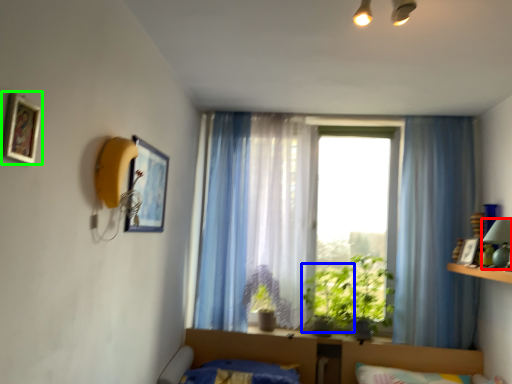
Question: Estimate the real-world distances between objects in this image. Which object is farther from lamp (highlighted by a red box), plant (highlighted by a blue box) or picture frame (highlighted by a green box)?

Choices:
 (A) plant
 (B) picture frame

Answer: (B)